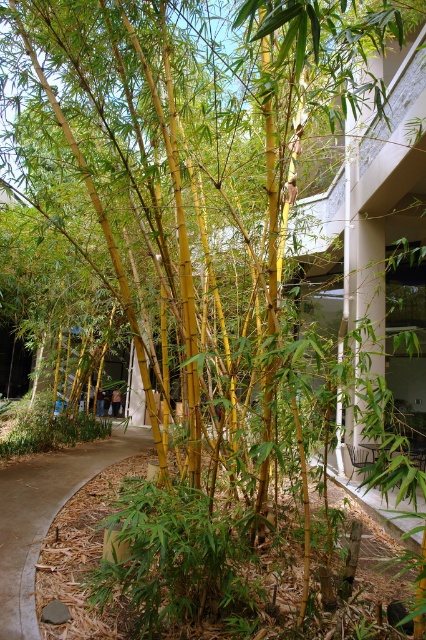
Question: Among these objects, which one is farthest from the camera?

Choices:
 (A) brown/dry leaves at center
 (B) brown mulch at lower left

Answer: (B)

Question: Which point is farther to the camera?

Choices:
 (A) brown mulch at lower left
 (B) brown/dry leaves at center

Answer: (A)

Question: Which point is farther to the camera?

Choices:
 (A) (83, 449)
 (B) (20, 460)

Answer: (A)

Question: Is brown/dry leaves at center to the right of brown mulch at lower left from the viewer's perspective?

Choices:
 (A) yes
 (B) no

Answer: (B)

Question: Can you confirm if brown/dry leaves at center is positioned to the right of brown mulch at lower left?

Choices:
 (A) yes
 (B) no

Answer: (B)

Question: Is brown/dry leaves at center wider than brown mulch at lower left?

Choices:
 (A) yes
 (B) no

Answer: (A)